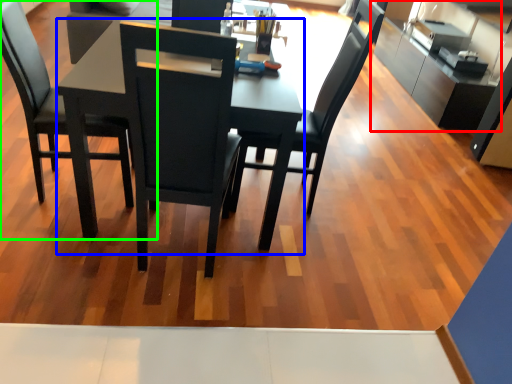
Question: Which is nearer to the cabinetry (highlighted by a red box)? round table (highlighted by a blue box) or chair (highlighted by a green box).

Choices:
 (A) round table
 (B) chair

Answer: (B)